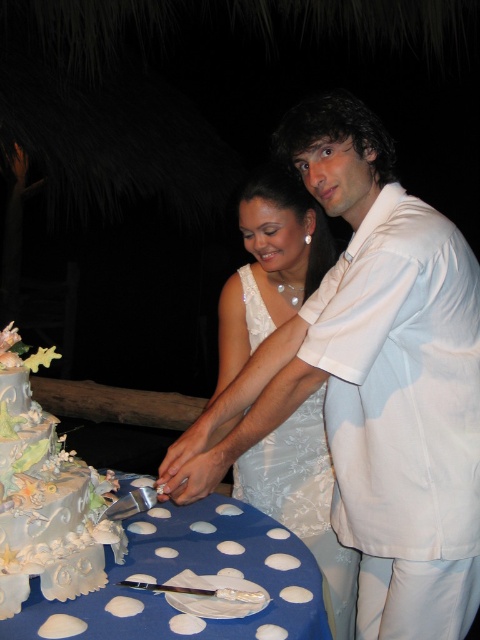
You are a photographer at the wedding and want to capture a photo where both the pastel silver cake at lower left and the white satin wedding dress at center are clearly visible. Which object should you adjust your camera focus on first to ensure both are in frame?

The pastel silver cake at lower left is in front of the white satin wedding dress at center. To ensure both are in frame, focus on the pastel silver cake at lower left first as it is closer to the camera, then adjust the focus to include the white satin wedding dress at center in the background.

You are a photographer at the wedding and want to ensure the blue polka dot tablecloth at lower center and the white satin wedding dress at center are both visible in the photo. Given their sizes, which object should you focus on to ensure both are in frame without cropping?

The blue polka dot tablecloth at lower center is wider than the white satin wedding dress at center. To capture both without cropping, focus on the tablecloth as it is larger and can accommodate the dress within the frame.

You are a photographer at the wedding and need to capture a closeup shot of the pastel silver cake at lower left and the white satin wedding dress at center. Since the camera can only focus on one object at a time, which object should you prioritize to ensure it fills the frame more?

The white satin wedding dress at center should be prioritized because it is larger than the pastel silver cake at lower left.